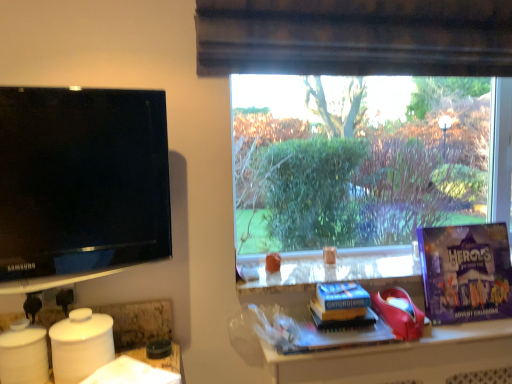
Question: Visually, is hardcover book at center, acting as the second book starting from the top, positioned to the left or to the right of purple cardboard advent calendar at right, marked as the second paperback book in a bottom-to-top arrangement?

Choices:
 (A) left
 (B) right

Answer: (A)

Question: Considering the positions of hardcover book at center, acting as the second book starting from the top, and purple cardboard advent calendar at right, the first paperback book positioned from the right, in the image, is hardcover book at center, acting as the second book starting from the top, taller or shorter than purple cardboard advent calendar at right, the first paperback book positioned from the right,?

Choices:
 (A) tall
 (B) short

Answer: (B)

Question: Which is farther from the blue paper at center, the 1th paperback book from the left?

Choices:
 (A) hardcover book at center, marked as the first book in a bottom-to-top arrangement
 (B) purple cardboard advent calendar at right, which is the second paperback book from left to right
 (C) matte black tv at left
 (D) yellow matte book at center, marked as the second book in a bottom-to-top arrangement

Answer: (C)

Question: Which of these objects is positioned closest to the hardcover book at center, acting as the second book starting from the top?

Choices:
 (A) yellow matte book at center, marked as the second book in a bottom-to-top arrangement
 (B) blue paper at center, which is the 1th paperback book from bottom to top
 (C) matte black tv at left
 (D) purple cardboard advent calendar at right, the first paperback book positioned from the right

Answer: (A)